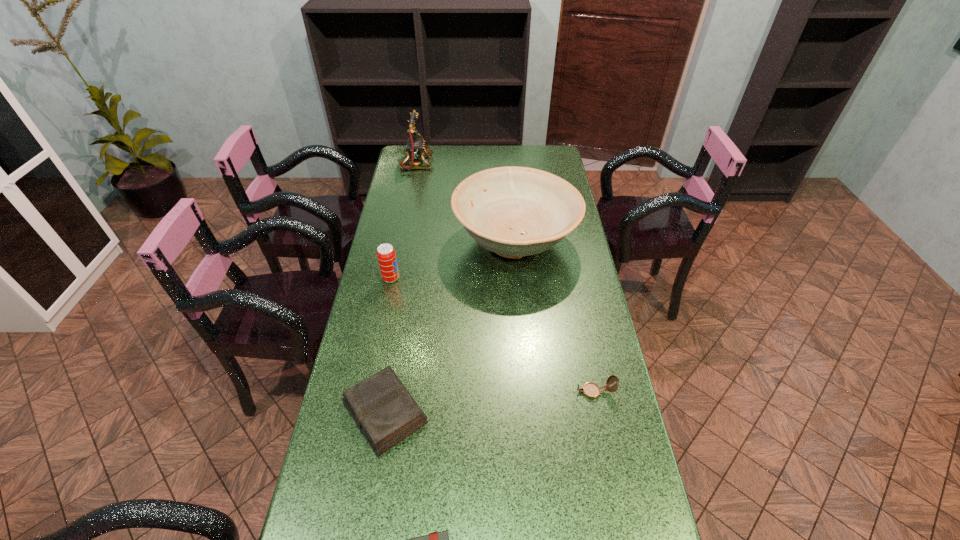
Locate an element on the screen. This screenshot has height=540, width=960. object that stands as the closest to the farthest object is located at coordinates (512, 211).

Identify which object is located as the third nearest to the soda can. Please provide its 2D coordinates. Your answer should be formatted as a tuple, i.e. [(x, y)], where the tuple contains the x and y coordinates of a point satisfying the conditions above.

[(415, 147)]